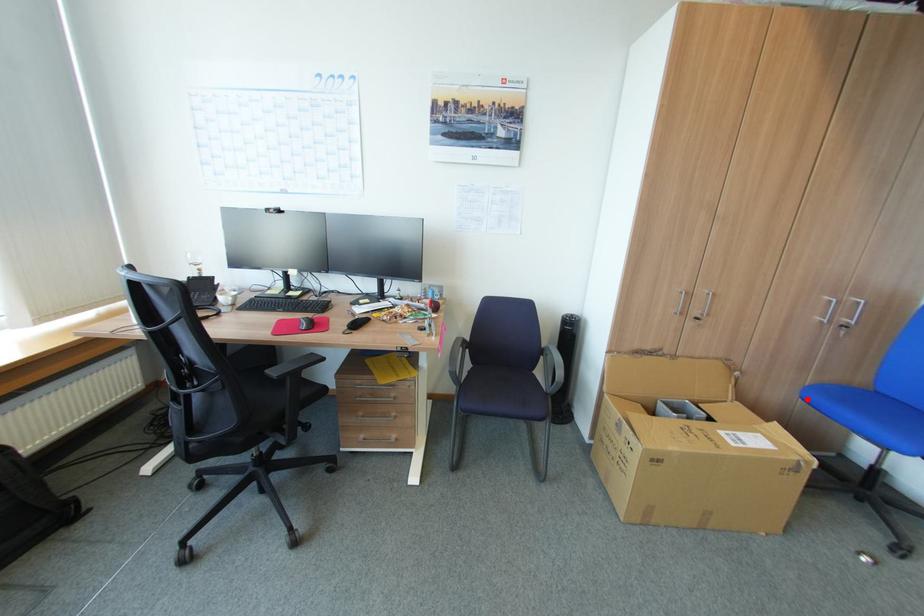
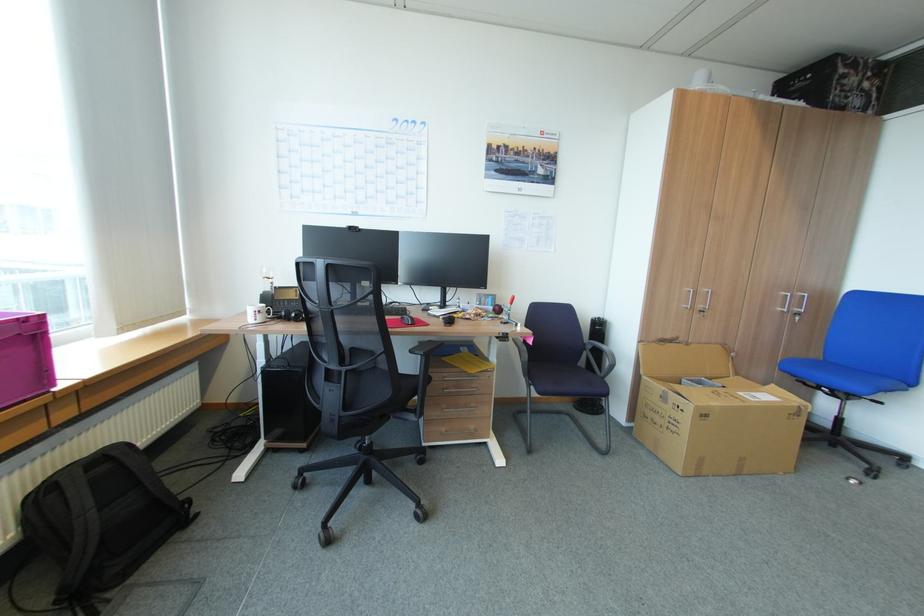
Where in the second image is the point corresponding to the highlighted location from the first image?

(786, 370)